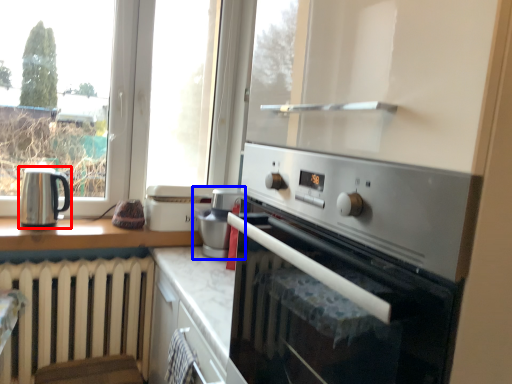
Question: Which object is further to the camera taking this photo, kitchen appliance (highlighted by a red box) or appliance (highlighted by a blue box)?

Choices:
 (A) kitchen appliance
 (B) appliance

Answer: (B)